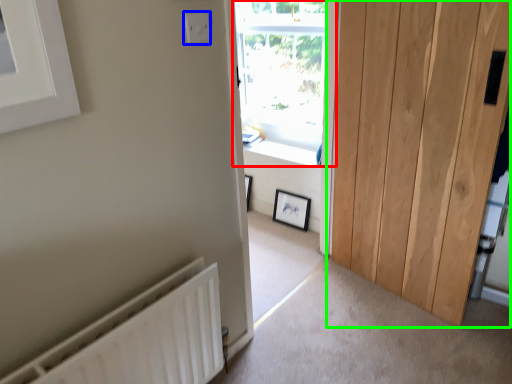
Question: Which object is positioned closest to window (highlighted by a red box)? Select from electric outlet (highlighted by a blue box) and door (highlighted by a green box).

Choices:
 (A) electric outlet
 (B) door

Answer: (B)